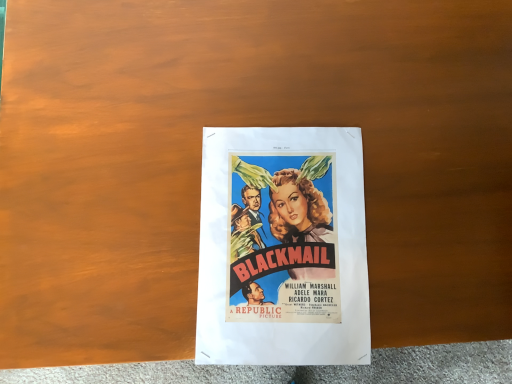
Locate an element on the screen. The image size is (512, 384). matte paper poster at center is located at coordinates (283, 248).

This screenshot has width=512, height=384. Describe the element at coordinates (283, 248) in the screenshot. I see `matte paper poster at center` at that location.

Where is `matte paper poster at center`? matte paper poster at center is located at coordinates (283, 248).